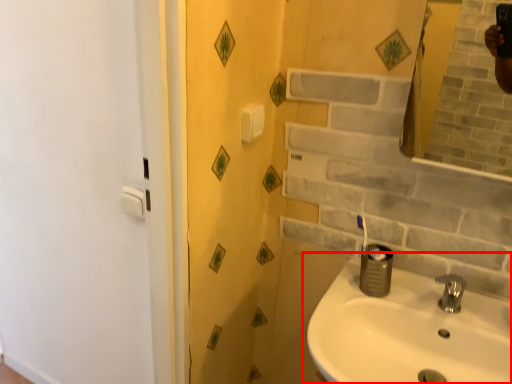
Question: Considering the relative positions of sink (annotated by the red box) and tap in the image provided, where is sink (annotated by the red box) located with respect to the staircase?

Choices:
 (A) right
 (B) left

Answer: (B)